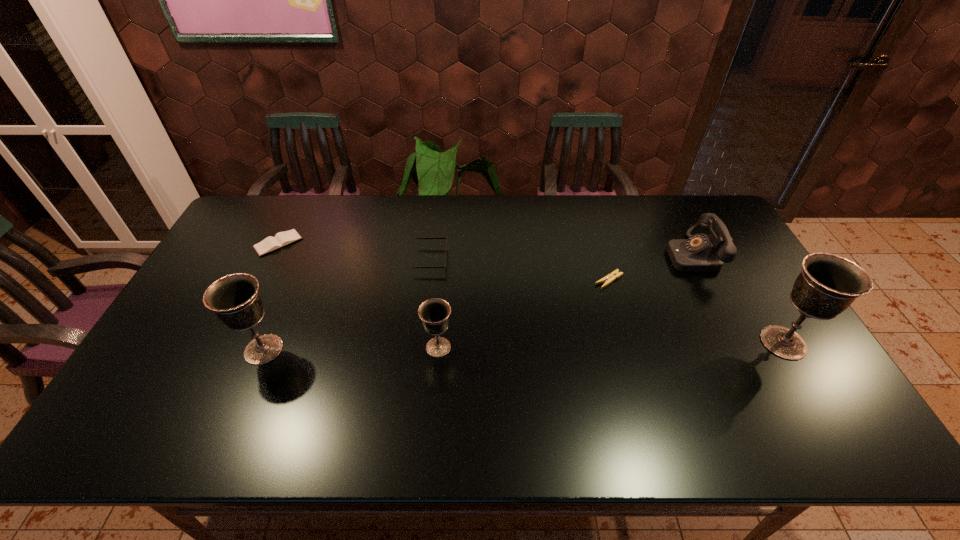
Where is `free space located on the right of the second chalice from right to left`? This screenshot has width=960, height=540. free space located on the right of the second chalice from right to left is located at coordinates (551, 347).

Find the location of a particular element. free region located on the back of the rightmost chalice is located at coordinates (734, 261).

The height and width of the screenshot is (540, 960). What are the coordinates of `vacant space situated on the front-facing side of the fifth tallest object` in the screenshot? It's located at (466, 259).

You are a GUI agent. You are given a task and a screenshot of the screen. Output one action in this format:
    pyautogui.click(x=<x>, y=<y>)
    Task: Click on the free location located 0.310m on the right of the third object from right to left
    The image size is (960, 540).
    Given the screenshot: What is the action you would take?
    pyautogui.click(x=725, y=280)

At what (x,y) coordinates should I click in order to perform the action: click on vacant space situated 0.170m on the front of the second shortest object. Please return your answer as a coordinate pair (x, y). The width and height of the screenshot is (960, 540). Looking at the image, I should click on (252, 296).

Find the location of a particular element. The height and width of the screenshot is (540, 960). free space located 0.120m on the dial of the telephone is located at coordinates (631, 255).

Where is `blank area located 0.120m on the dial of the telephone`? blank area located 0.120m on the dial of the telephone is located at coordinates (631, 255).

This screenshot has height=540, width=960. What are the coordinates of `vacant region located 0.340m on the dial of the telephone` in the screenshot? It's located at [564, 255].

Identify the location of diary that is at the far edge. The height and width of the screenshot is (540, 960). (281, 239).

Identify the location of telephone present at the far edge. (699, 253).